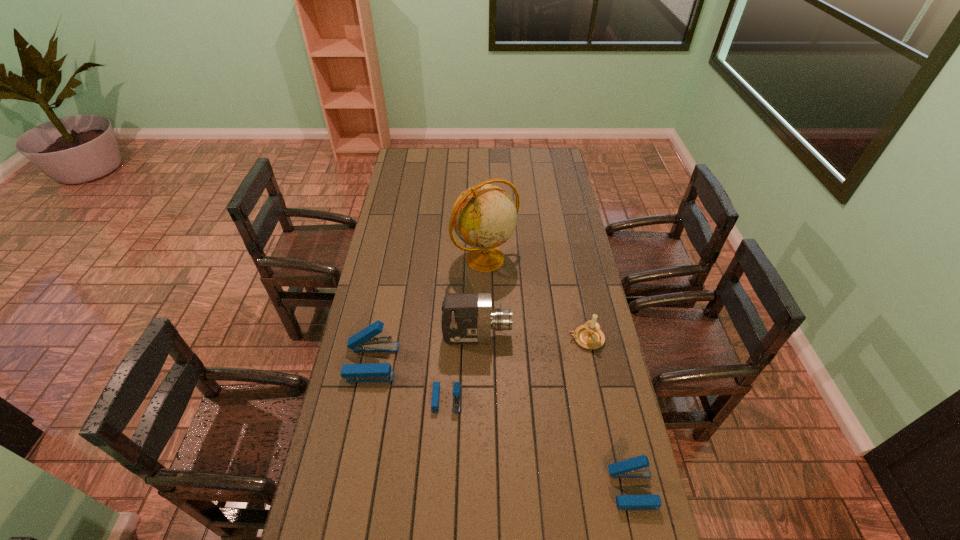
Identify the location of stapler located at the right edge. The width and height of the screenshot is (960, 540). (637, 467).

This screenshot has height=540, width=960. In order to click on candle holder situated at the right edge in this screenshot , I will do point(589,336).

At what (x,y) coordinates should I click in order to perform the action: click on object at the near right corner. Please return your answer as a coordinate pair (x, y). This screenshot has width=960, height=540. Looking at the image, I should click on (637, 467).

The height and width of the screenshot is (540, 960). Find the location of `vacant space at the far edge of the desktop`. vacant space at the far edge of the desktop is located at coordinates (469, 153).

At what (x,y) coordinates should I click in order to perform the action: click on vacant space at the left edge. Please return your answer as a coordinate pair (x, y). Looking at the image, I should click on (409, 235).

Image resolution: width=960 pixels, height=540 pixels. I want to click on vacant space at the right edge, so click(559, 178).

Locate an element on the screen. empty space that is in between the camcorder and the rightmost stapler is located at coordinates (555, 413).

Find the location of a particular element. vacant space in between the farthest object and the tallest stapler is located at coordinates (428, 310).

The width and height of the screenshot is (960, 540). Find the location of `free space between the second stapler from left to right and the camcorder`. free space between the second stapler from left to right and the camcorder is located at coordinates (462, 368).

Locate an element on the screen. free spot between the camcorder and the second farthest stapler is located at coordinates (462, 368).